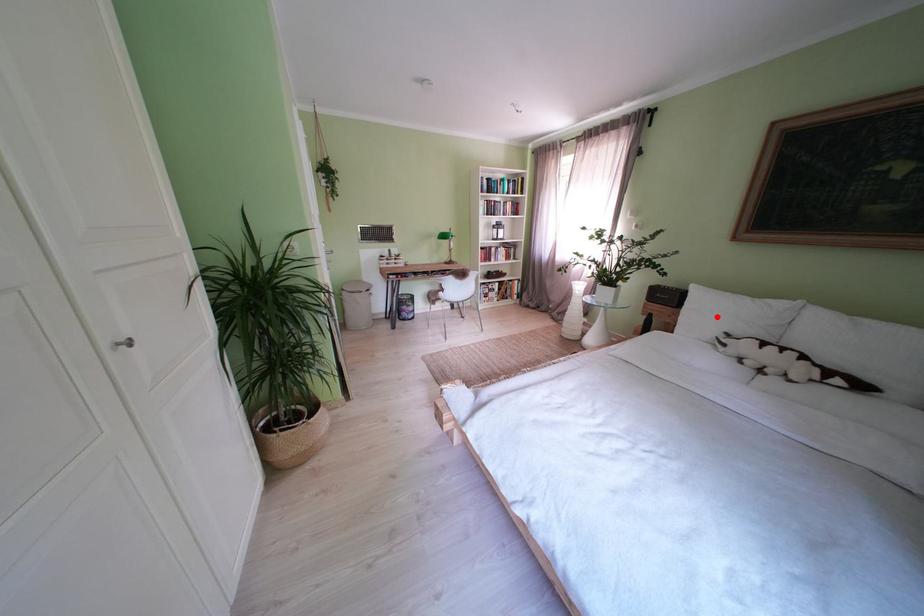
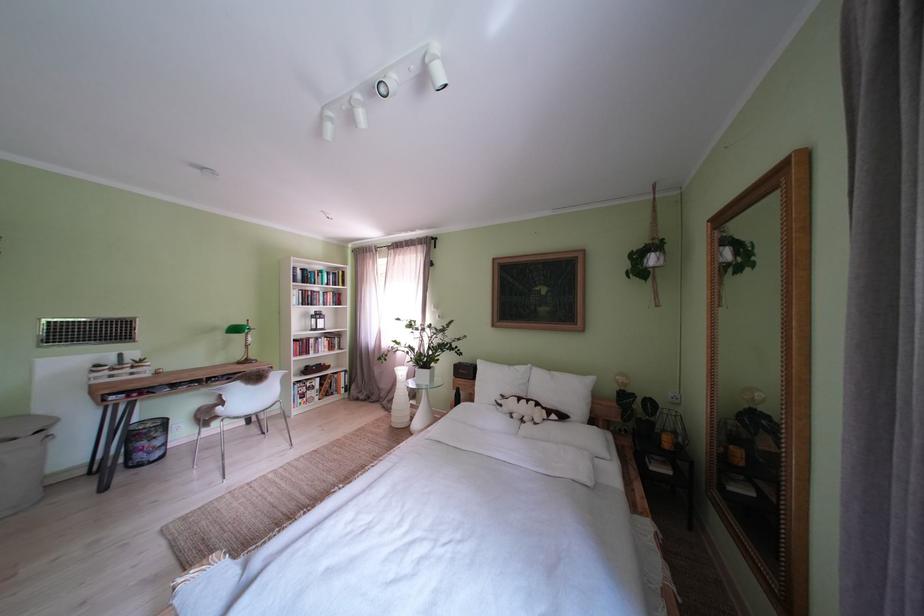
Question: I am providing you with two images of the same scene from different viewpoints. In image1, a red point is highlighted. Considering the same 3D point in image2, which of the following is correct?

Choices:
 (A) It is closer
 (B) It is farther

Answer: (B)